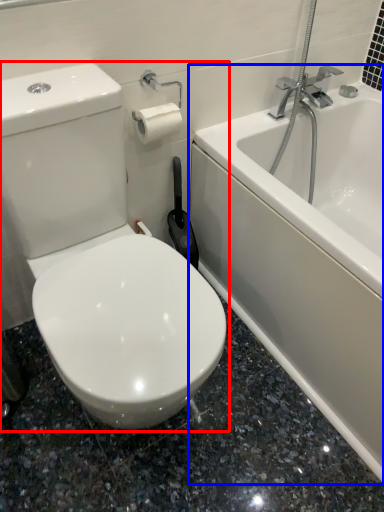
Question: Which object is further to the camera taking this photo, toilet (highlighted by a red box) or bathtub (highlighted by a blue box)?

Choices:
 (A) toilet
 (B) bathtub

Answer: (B)